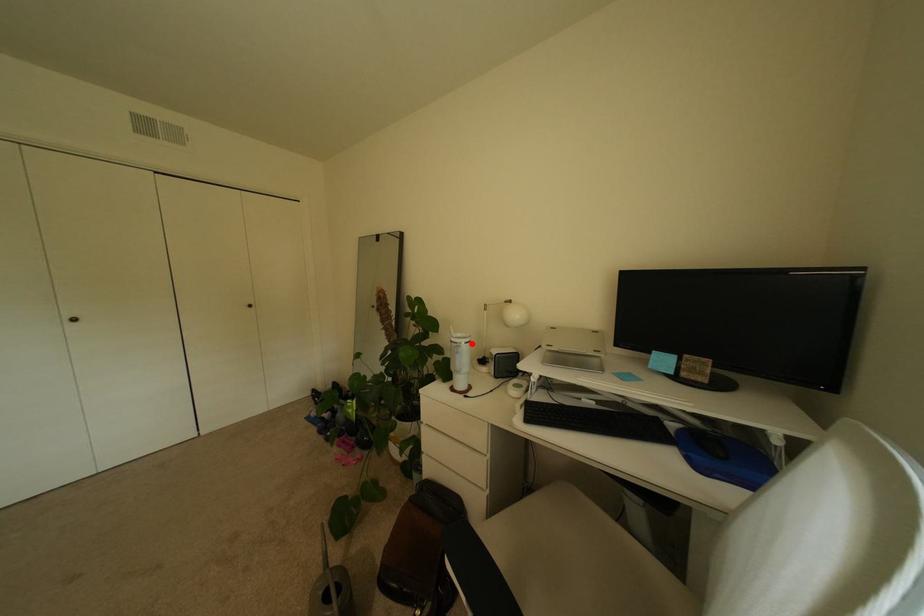
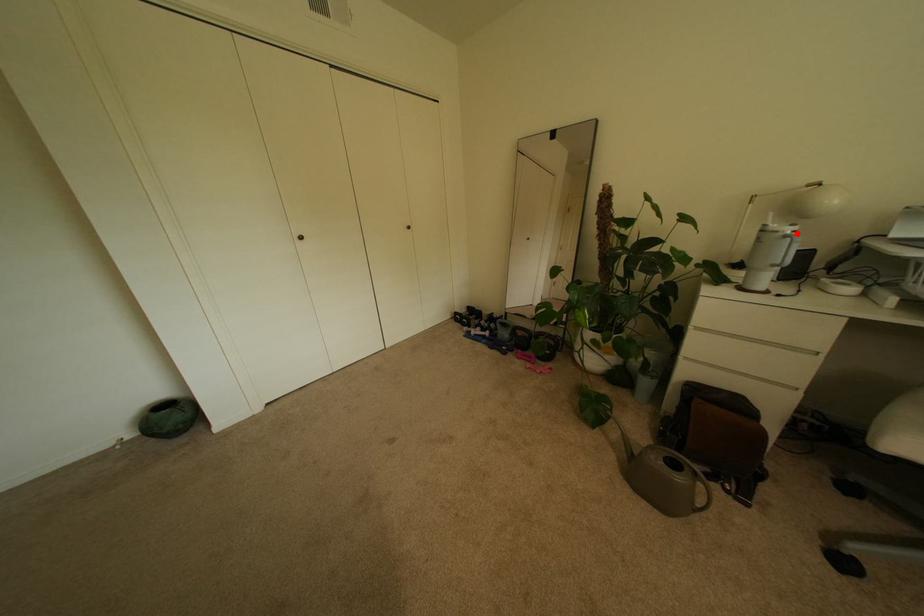
In the scene shown: I am providing you with two images of the same scene from different viewpoints. A red point is marked on the first image and another point is marked on the second image. Is the marked point in image1 the same physical position as the marked point in image2?

Yes